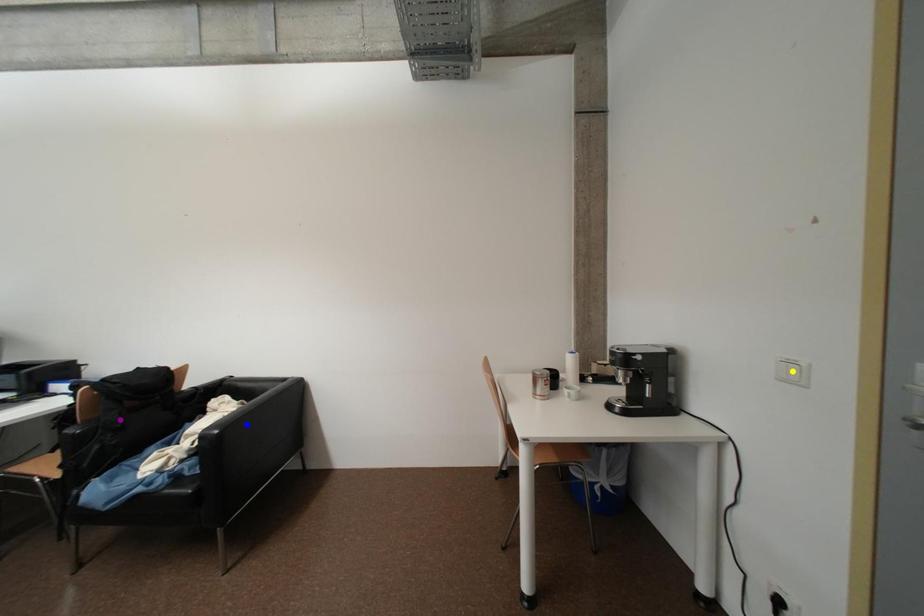
Consider the image. Order these from nearest to farthest:
yellow point | purple point | blue point

yellow point < purple point < blue point